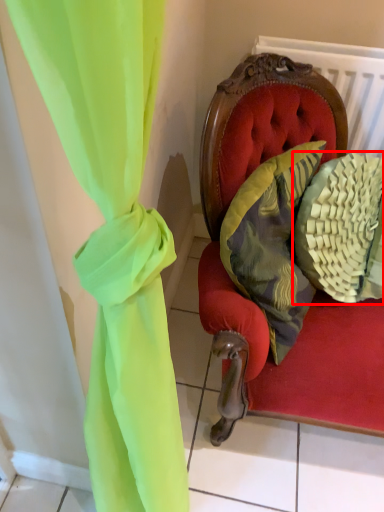
Question: From the image, what is the correct spatial relationship of pillow (annotated by the red box) in relation to pillow?

Choices:
 (A) left
 (B) right

Answer: (B)